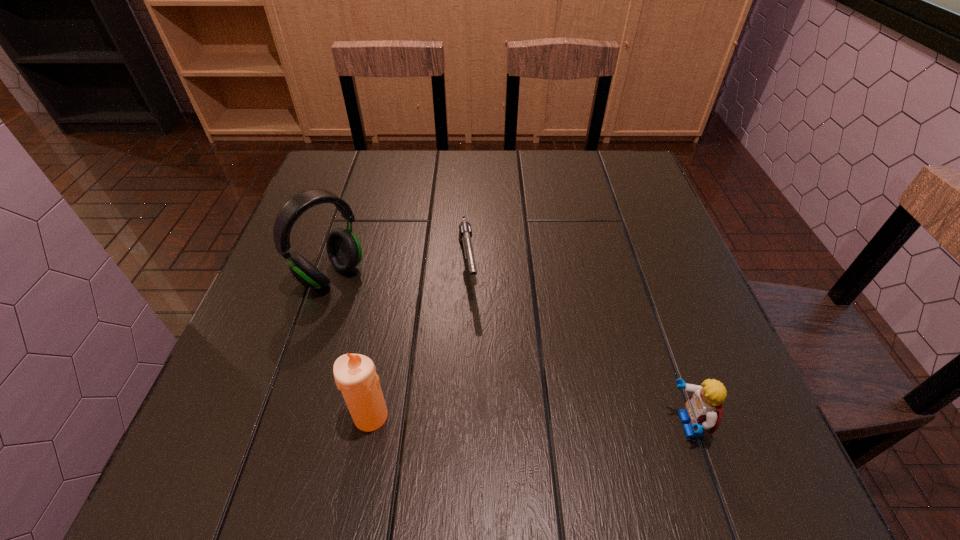
The width and height of the screenshot is (960, 540). Identify the location of empty space between the candle and the rightmost object. (529, 421).

What are the coordinates of `free space between the third object from right to left and the rightmost object` in the screenshot? It's located at (529, 421).

Identify the location of vacant space that is in between the Lego and the third object from right to left. (529, 421).

Locate an element on the screen. The image size is (960, 540). empty location between the leftmost object and the rightmost object is located at coordinates (509, 350).

Find the location of a particular element. The width and height of the screenshot is (960, 540). free space between the leftmost object and the second object from left to right is located at coordinates (351, 346).

Where is `vacant region between the shortest object and the third object from right to left`? vacant region between the shortest object and the third object from right to left is located at coordinates (420, 341).

At what (x,y) coordinates should I click in order to perform the action: click on free space between the leftmost object and the shortest object. Please return your answer as a coordinate pair (x, y). The height and width of the screenshot is (540, 960). Looking at the image, I should click on (399, 271).

The width and height of the screenshot is (960, 540). Identify the location of the third closest object to the Lego. (344, 251).

The height and width of the screenshot is (540, 960). I want to click on the third closest object to the second object from left to right, so click(x=703, y=411).

This screenshot has height=540, width=960. Find the location of `free space that satisfies the following two spatial constraints: 1. on the back side of the second object from right to left; 2. on the left side of the leftmost object`. free space that satisfies the following two spatial constraints: 1. on the back side of the second object from right to left; 2. on the left side of the leftmost object is located at coordinates (335, 265).